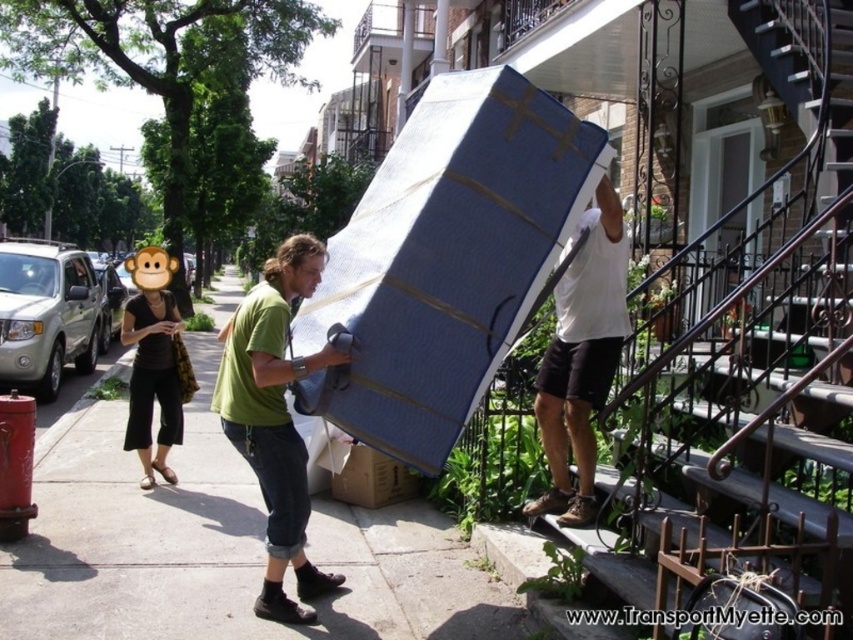
You are a delivery person trying to move a heavy object across the sidewalk. The smooth concrete sidewalk at center is under the green cotton shirt at center. Is the sidewalk a good surface to place the object on?

The smooth concrete sidewalk at center is positioned under green cotton shirt at center, so the sidewalk is a good surface to place the object on because it is flat and stable.

You are standing at the entrance of the building and need to hand a package to the person wearing the green cotton shirt at center. According to the scene, where should you look to find them?

The green cotton shirt at center is located at point (276, 419), so you should look towards that coordinate to find them.

You are trying to move a large object across the scene. The smooth concrete sidewalk at center and the green cotton shirt at center are both in your path. Which one is shorter and therefore easier to step over?

The smooth concrete sidewalk at center is shorter than the green cotton shirt at center, so it would be easier to step over.